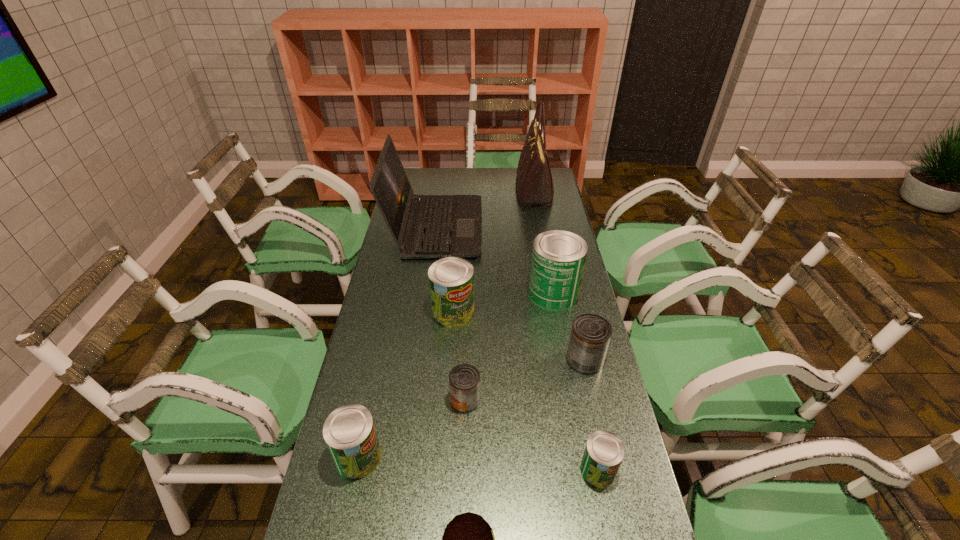
Locate an element on the screen. vacant point located on the back of the leftmost green can is located at coordinates (380, 356).

Where is `vacant region located on the front of the bigger red can`? vacant region located on the front of the bigger red can is located at coordinates (612, 487).

Where is `free space located on the back of the smallest green can`? The width and height of the screenshot is (960, 540). free space located on the back of the smallest green can is located at coordinates (583, 395).

This screenshot has width=960, height=540. What are the coordinates of `free space located 0.130m on the back of the left red can` in the screenshot? It's located at (467, 352).

The width and height of the screenshot is (960, 540). Identify the location of object that is at the far edge. (534, 184).

Locate an element on the screen. laptop_computer located at the left edge is located at coordinates (423, 226).

I want to click on can present at the left edge, so coord(349,432).

This screenshot has height=540, width=960. Find the location of `handbag that is at the right edge`. handbag that is at the right edge is located at coordinates (534, 184).

This screenshot has width=960, height=540. What are the coordinates of `object at the far right corner` in the screenshot? It's located at (534, 184).

I want to click on vacant space at the far edge of the desktop, so click(471, 168).